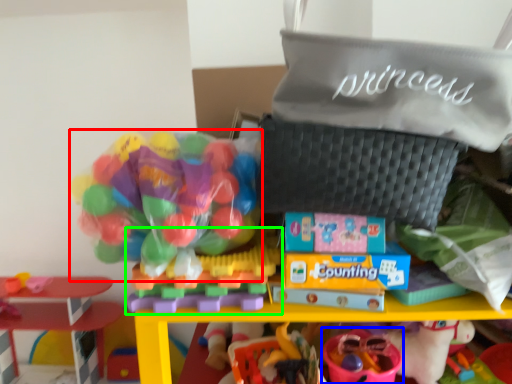
Question: Considering the real-world distances, which object is closest to toy (highlighted by a red box)? toy (highlighted by a blue box) or toy (highlighted by a green box).

Choices:
 (A) toy
 (B) toy

Answer: (B)